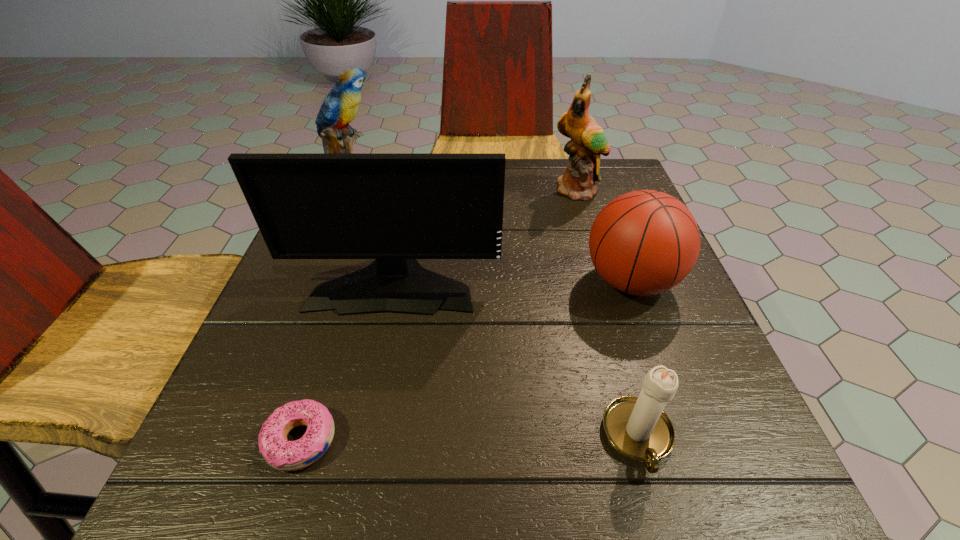
The image size is (960, 540). I want to click on the left parrot, so click(340, 107).

Find the location of a particular element. the right parrot is located at coordinates (588, 142).

Identify the location of monitor. The height and width of the screenshot is (540, 960). (393, 207).

You are a GUI agent. You are given a task and a screenshot of the screen. Output one action in this format:
    pyautogui.click(x=<x>, y=<y>)
    Task: Click on the basketball
    
    Given the screenshot: What is the action you would take?
    pyautogui.click(x=645, y=242)

This screenshot has height=540, width=960. Find the location of `candle holder`. candle holder is located at coordinates pyautogui.click(x=637, y=427).

The image size is (960, 540). What are the coordinates of `the shortest object` in the screenshot? It's located at (281, 454).

The width and height of the screenshot is (960, 540). Find the location of `free space located on the face of the left parrot`. free space located on the face of the left parrot is located at coordinates (508, 194).

The height and width of the screenshot is (540, 960). What are the coordinates of `vacant space located on the front-facing side of the right parrot` in the screenshot? It's located at (586, 215).

I want to click on free spot located 0.100m on the screen side of the monitor, so click(377, 361).

What are the coordinates of `free space located on the back of the basketball` in the screenshot? It's located at (610, 223).